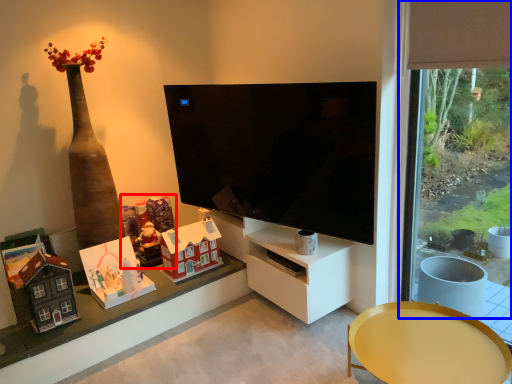
Question: Which object is further to the camera taking this photo, toy (highlighted by a red box) or window frame (highlighted by a blue box)?

Choices:
 (A) toy
 (B) window frame

Answer: (A)